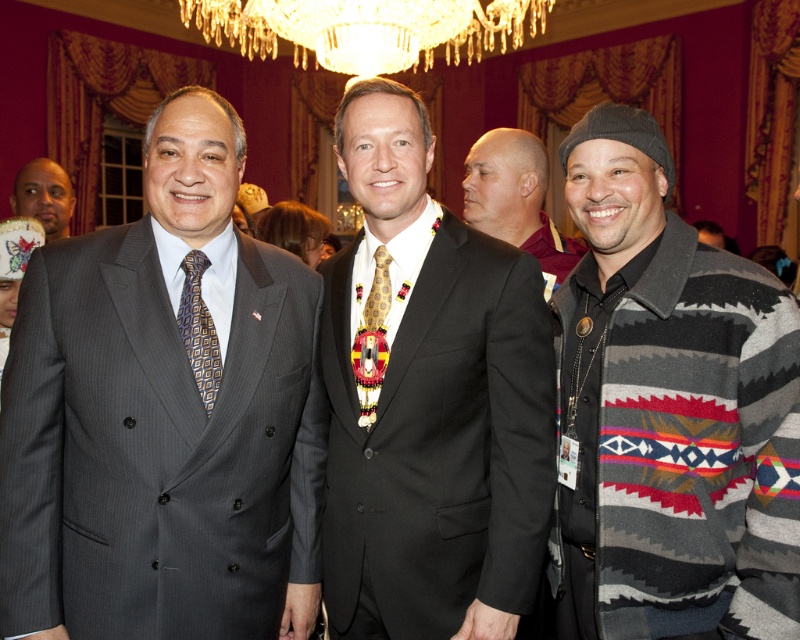
Question: Can you confirm if geometric patterned silk tie at left is wider than matte black suit at left?

Choices:
 (A) yes
 (B) no

Answer: (B)

Question: Which point is farther to the camera?

Choices:
 (A) gray pinstripe suit at left
 (B) gray knit sweater at center
 (C) knit sweater at right
 (D) black suit at center

Answer: (B)

Question: Which of these objects is positioned farthest from the gray pinstripe suit at left?

Choices:
 (A) geometric patterned silk tie at left
 (B) matte black suit at left
 (C) gray knit sweater at center

Answer: (B)

Question: Which object is closer to the camera taking this photo?

Choices:
 (A) geometric patterned silk tie at left
 (B) gold metallic tie at center
 (C) matte black suit at left
 (D) gray pinstripe suit at left

Answer: (A)

Question: Observing the image, what is the correct spatial positioning of knit sweater at right in reference to gold metallic tie at center?

Choices:
 (A) right
 (B) left

Answer: (A)

Question: Is black suit at center to the right of gray knit sweater at center from the viewer's perspective?

Choices:
 (A) yes
 (B) no

Answer: (B)